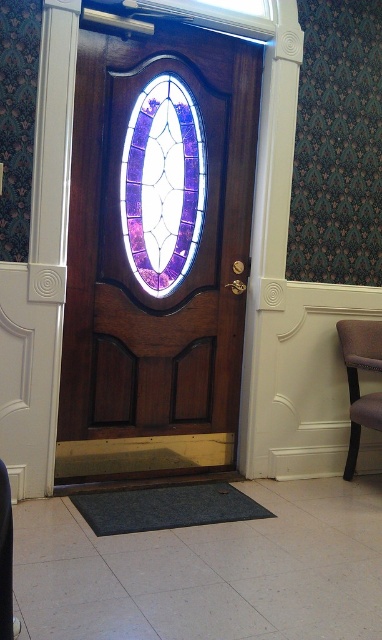
In the scene shown: You are trying to determine if the purple stained glass at center can fit through the doorway if the velvet brown chair at right is blocking the way. Based on their widths, which object is wider?

The purple stained glass at center is wider than the velvet brown chair at right, so it cannot fit through the doorway if the chair is blocking the way.

Based on the photo, you are standing in front of the wooden door with the stained glass window. You notice two points marked on the door frame. The first point is at coordinates point (242, 76) and the second point is at point (354, 378). Which of these two points is closer to you?

Point (242, 76) is closer to the viewer than point (354, 378).

You are standing in front of the entrance and want to sit down on the velvet brown chair at right. Which direction should you move to reach the chair from the polished wood door at center?

The polished wood door at center is located above the velvet brown chair at right, so you should move downward or to the right to reach the chair.